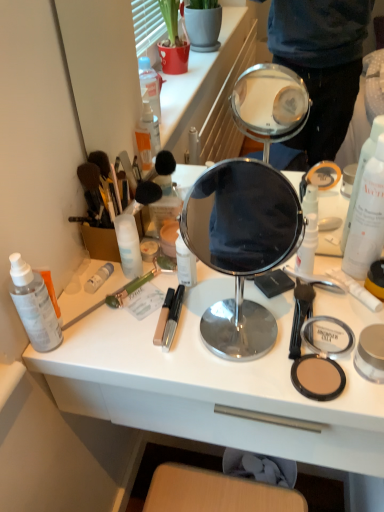
Identify the location of free space on the front side of white matte tube at left, which ranks as the third toiletry in left-to-right order. This screenshot has height=512, width=384. (111, 336).